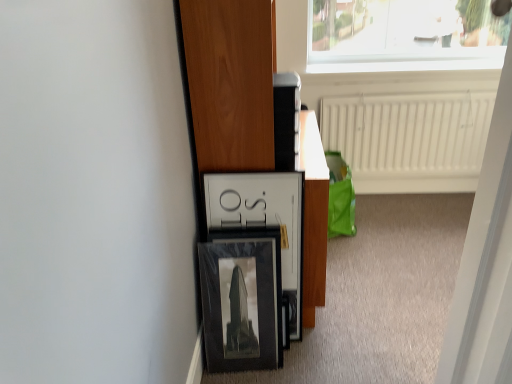
Identify the location of white textured radiator at upper center. Image resolution: width=512 pixels, height=384 pixels. (409, 139).

At what (x,y) coordinates should I click in order to perform the action: click on white textured radiator at upper center. Please return your answer as a coordinate pair (x, y). The width and height of the screenshot is (512, 384). Looking at the image, I should click on (409, 139).

Could you tell me if matte black frame at center is facing white textured radiator at upper center?

No, matte black frame at center is not aimed at white textured radiator at upper center.

Is matte black frame at center placed right next to white textured radiator at upper center?

There is a gap between matte black frame at center and white textured radiator at upper center.

The width and height of the screenshot is (512, 384). I want to click on furniture in front of the white textured radiator at upper center, so click(x=231, y=81).

Is point (487, 295) positioned in front of point (267, 42)?

Yes, it is.

This screenshot has width=512, height=384. What are the coordinates of `furniture above the white plastic screen door at upper right (from the image's perspective)` in the screenshot? It's located at (231, 81).

Considering the sizes of white plastic screen door at upper right and matte black frame at center in the image, is white plastic screen door at upper right taller or shorter than matte black frame at center?

Clearly, white plastic screen door at upper right is shorter compared to matte black frame at center.

Does white plastic screen door at upper right lie behind matte black frame at center?

No.

Considering the points (359, 165) and (258, 25), which point is behind, point (359, 165) or point (258, 25)?

Positioned behind is point (359, 165).

Is there a large distance between white textured radiator at upper center and matte black frame at center?

Absolutely, white textured radiator at upper center is distant from matte black frame at center.

Considering the sizes of objects white textured radiator at upper center and matte black frame at center in the image provided, who is thinner, white textured radiator at upper center or matte black frame at center?

Thinner between the two is white textured radiator at upper center.

From a real-world perspective, is white textured radiator at upper center on matte black frame at center?

Actually, white textured radiator at upper center is physically below matte black frame at center in the real world.

Could you tell me if white plastic screen door at upper right is facing white textured radiator at upper center?

No, white plastic screen door at upper right is not oriented towards white textured radiator at upper center.

Is white plastic screen door at upper right taller or shorter than white textured radiator at upper center?

In the image, white plastic screen door at upper right appears to be taller than white textured radiator at upper center.

From the image's perspective, which is below, white plastic screen door at upper right or white textured radiator at upper center?

From the image's view, white plastic screen door at upper right is below.

Between white plastic screen door at upper right and white textured radiator at upper center, which one has smaller width?

white plastic screen door at upper right is thinner.

Consider the image. Is matte black frame at center completely or partially outside of white plastic screen door at upper right?

Indeed, matte black frame at center is completely outside white plastic screen door at upper right.

From the image's perspective, is matte black frame at center on white plastic screen door at upper right?

Indeed, from the image's perspective, matte black frame at center is shown above white plastic screen door at upper right.

Considering the positions of points (261, 149) and (480, 185), is point (261, 149) closer to camera compared to point (480, 185)?

No, (261, 149) is further to viewer.

Between point (425, 122) and point (498, 192), which one is positioned behind?

The point (425, 122) is farther from the camera.

From the image's perspective, would you say white textured radiator at upper center is positioned over white plastic screen door at upper right?

Yes, from the image's perspective, white textured radiator at upper center is over white plastic screen door at upper right.

Find the location of a particular element. The height and width of the screenshot is (384, 512). radiator on the right of matte black frame at center is located at coordinates (409, 139).

Locate an element on the screen. This screenshot has height=384, width=512. furniture to the left of white plastic screen door at upper right is located at coordinates (231, 81).

Considering their positions, is white textured radiator at upper center positioned further to white plastic screen door at upper right than matte black frame at center?

white textured radiator at upper center lies further to white plastic screen door at upper right than the other object.

From the picture: Estimate the real-world distances between objects in this image. Which object is closer to white plastic screen door at upper right, matte black frame at center or white textured radiator at upper center?

The object closer to white plastic screen door at upper right is matte black frame at center.

Based on their spatial positions, is white plastic screen door at upper right or matte black frame at center closer to white textured radiator at upper center?

Based on the image, matte black frame at center appears to be nearer to white textured radiator at upper center.

From the picture: Considering their positions, is matte black frame at center positioned further to white textured radiator at upper center than white plastic screen door at upper right?

The object further to white textured radiator at upper center is white plastic screen door at upper right.

Based on their spatial positions, is white textured radiator at upper center or white plastic screen door at upper right further from matte black frame at center?

white textured radiator at upper center is positioned further to the anchor matte black frame at center.

Based on their spatial positions, is white plastic screen door at upper right or white textured radiator at upper center further from matte black frame at center?

white textured radiator at upper center lies further to matte black frame at center than the other object.

The width and height of the screenshot is (512, 384). Identify the location of furniture between white plastic screen door at upper right and white textured radiator at upper center along the z-axis. (231, 81).